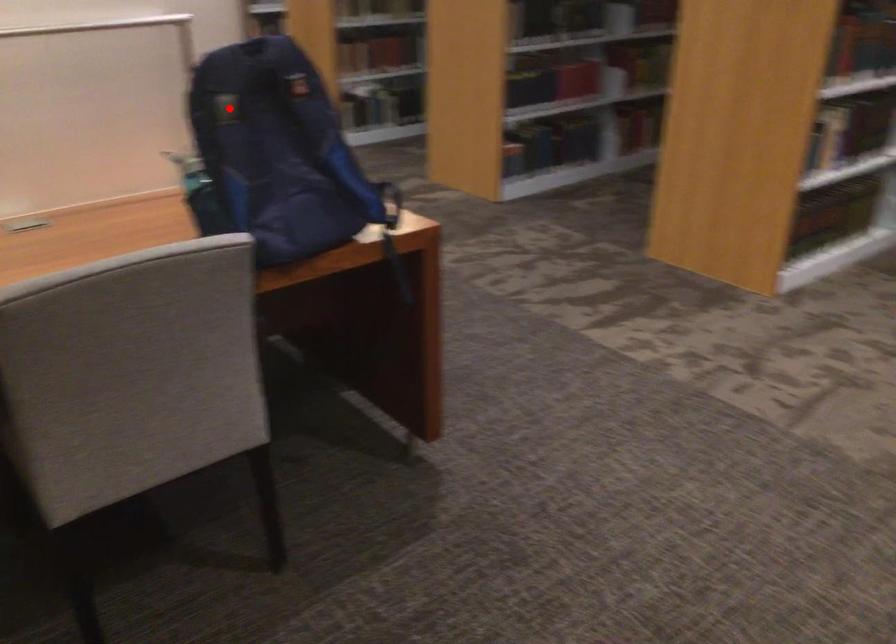
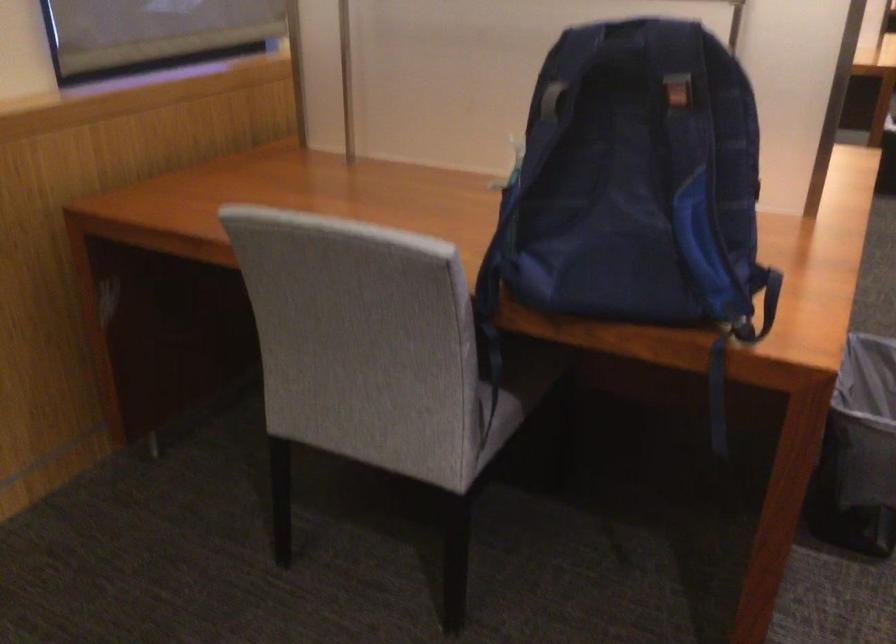
Question: I am providing you with two images of the same scene from different viewpoints. Given a red point in image1, look at the same physical point in image2. Is it:

Choices:
 (A) Closer to the viewpoint
 (B) Farther from the viewpoint

Answer: (A)